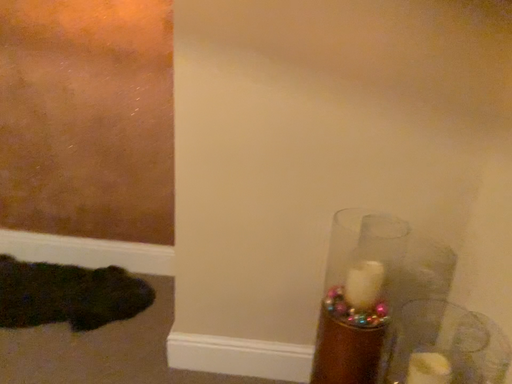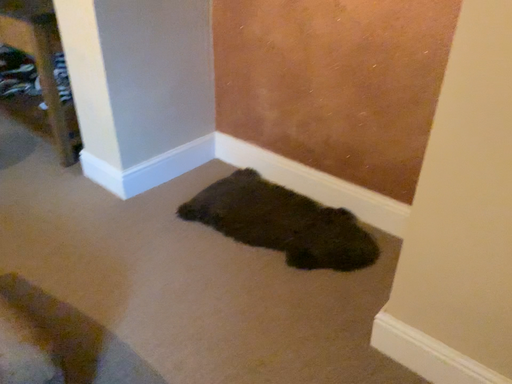
Question: Which way did the camera rotate in the video?

Choices:
 (A) rotated right
 (B) rotated left

Answer: (B)